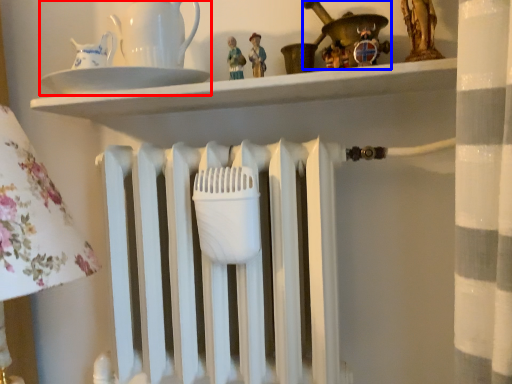
Question: Which object appears farthest to the camera in this image, tea set (highlighted by a red box) or toy (highlighted by a blue box)?

Choices:
 (A) tea set
 (B) toy

Answer: (A)